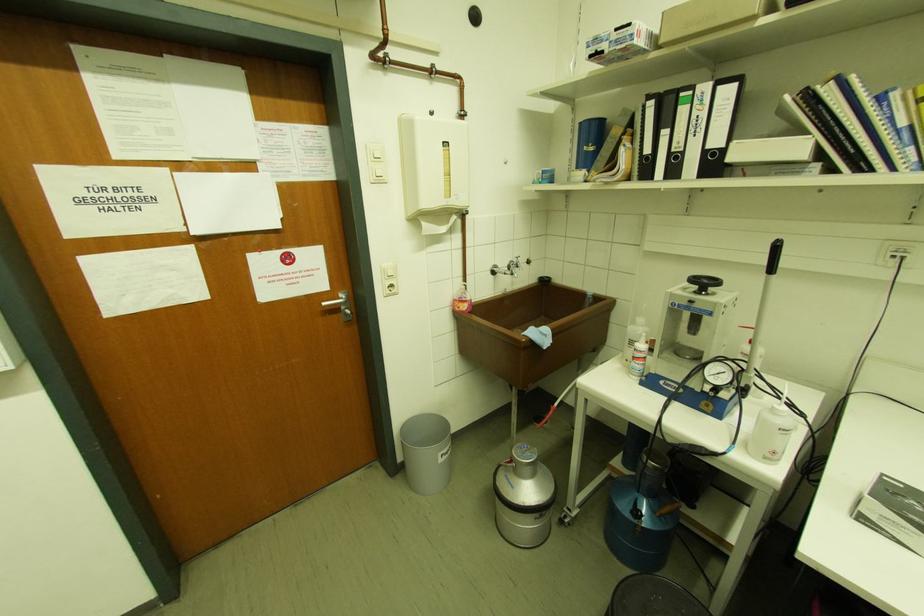
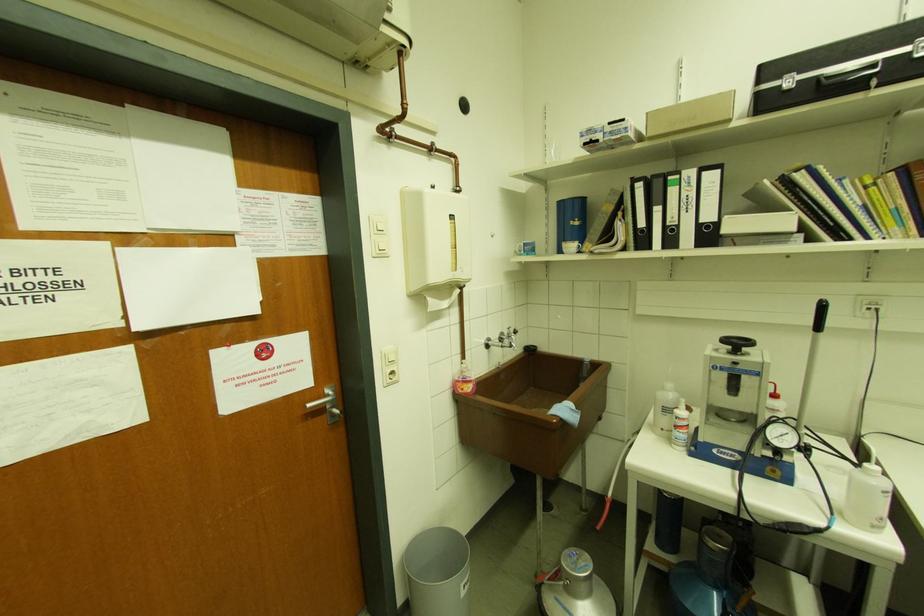
Find the pixel in the second image that matches (x=383, y=182) in the first image.

(385, 256)